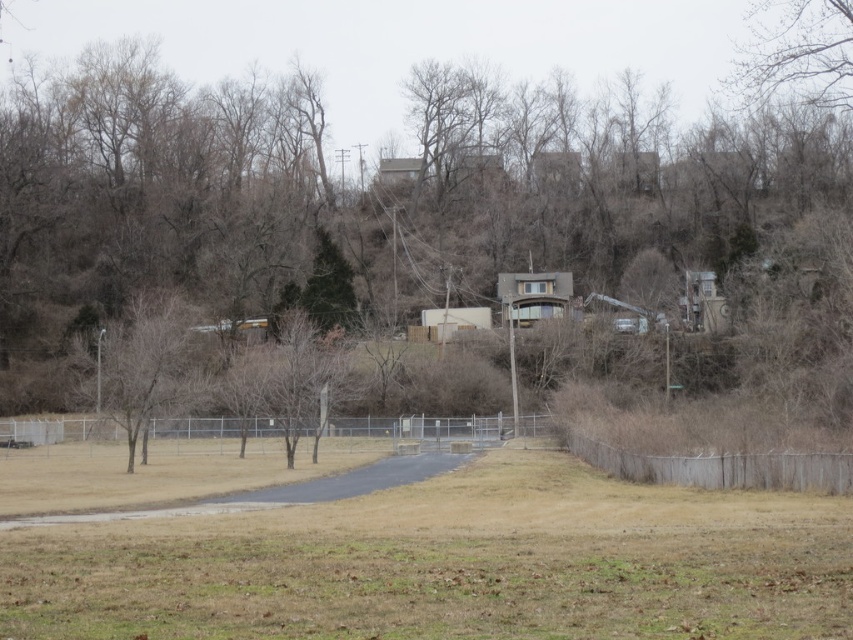
You are standing on the paved path in the foreground and want to walk towards the fenced enclosure. Which tree, the brown textured tree at center or the brown leafless tree at left, will you pass closer to?

The brown textured tree at center is bigger than the brown leafless tree at left, so you will pass closer to the brown textured tree at center.

You are standing on the paved path in the rural landscape. You notice the brown textured tree at center and the brown dry grass at lower center. Which object is located above the other?

The brown textured tree at center is positioned over brown dry grass at lower center.